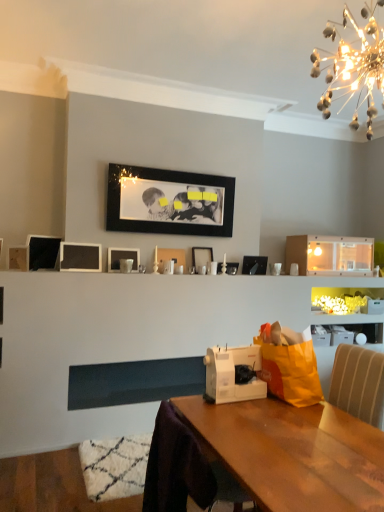
Question: Is matte black picture frame at center, which is counted as the sixth picture frame, starting from the left, at the left side of white plastic sewing machine at center?

Choices:
 (A) no
 (B) yes

Answer: (B)

Question: From a real-world perspective, is matte black picture frame at center, which ranks as the 3th picture frame in right-to-left order, below white plastic sewing machine at center?

Choices:
 (A) no
 (B) yes

Answer: (A)

Question: Is matte black picture frame at center, which ranks as the 3th picture frame in right-to-left order, directly adjacent to white plastic sewing machine at center?

Choices:
 (A) no
 (B) yes

Answer: (A)

Question: Considering the relative sizes of matte black picture frame at center, which is counted as the sixth picture frame, starting from the left, and white plastic sewing machine at center in the image provided, is matte black picture frame at center, which is counted as the sixth picture frame, starting from the left, shorter than white plastic sewing machine at center?

Choices:
 (A) yes
 (B) no

Answer: (A)

Question: Does matte black picture frame at center, which ranks as the 3th picture frame in right-to-left order, have a greater width compared to white plastic sewing machine at center?

Choices:
 (A) no
 (B) yes

Answer: (A)

Question: From the image's perspective, is orange fabric shopping bag at right located above or below matte black picture frame at upper left, acting as the eighth picture frame starting from the right?

Choices:
 (A) below
 (B) above

Answer: (A)

Question: Considering the positions of orange fabric shopping bag at right and matte black picture frame at upper left, the 1th picture frame when ordered from left to right, in the image, is orange fabric shopping bag at right bigger or smaller than matte black picture frame at upper left, the 1th picture frame when ordered from left to right,?

Choices:
 (A) big
 (B) small

Answer: (A)

Question: Considering their positions, is orange fabric shopping bag at right located in front of or behind matte black picture frame at upper left, the 1th picture frame when ordered from left to right?

Choices:
 (A) front
 (B) behind

Answer: (A)

Question: Is orange fabric shopping bag at right to the left or to the right of matte black picture frame at upper left, acting as the eighth picture frame starting from the right, in the image?

Choices:
 (A) left
 (B) right

Answer: (B)

Question: From the image's perspective, relative to matte black picture frame at center, which is counted as the sixth picture frame, starting from the left, is white glossy cabinet at upper center above or below?

Choices:
 (A) above
 (B) below

Answer: (A)

Question: In terms of height, does white glossy cabinet at upper center look taller or shorter compared to matte black picture frame at center, which ranks as the 3th picture frame in right-to-left order?

Choices:
 (A) short
 (B) tall

Answer: (B)

Question: Is white glossy cabinet at upper center to the left or to the right of matte black picture frame at center, which is counted as the sixth picture frame, starting from the left, in the image?

Choices:
 (A) left
 (B) right

Answer: (B)

Question: Which is correct: white glossy cabinet at upper center is inside matte black picture frame at center, which ranks as the 3th picture frame in right-to-left order, or outside of it?

Choices:
 (A) outside
 (B) inside

Answer: (A)

Question: Considering their positions, is matte black picture frame at upper left, the 1th picture frame when ordered from left to right, located in front of or behind orange fabric shopping bag at right?

Choices:
 (A) behind
 (B) front

Answer: (A)

Question: Is matte black picture frame at upper left, the 1th picture frame when ordered from left to right, wider or thinner than orange fabric shopping bag at right?

Choices:
 (A) wide
 (B) thin

Answer: (B)